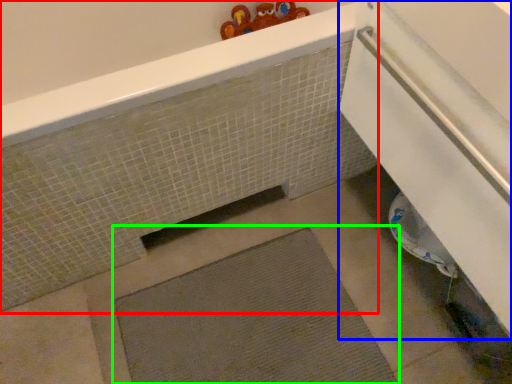
Question: Which is farther away from bath (highlighted by a red box)? screen door (highlighted by a blue box) or bath mat (highlighted by a green box)?

Choices:
 (A) screen door
 (B) bath mat

Answer: (A)